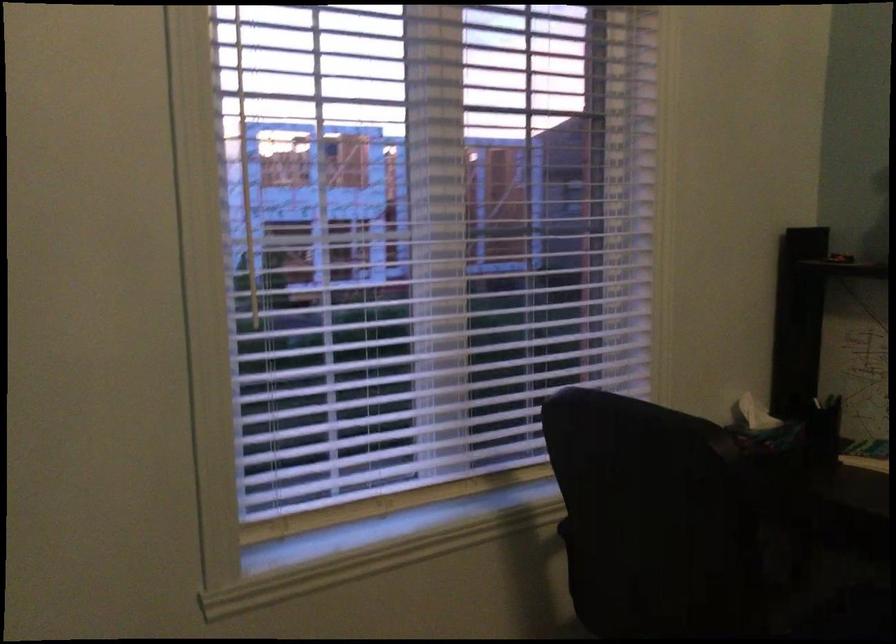
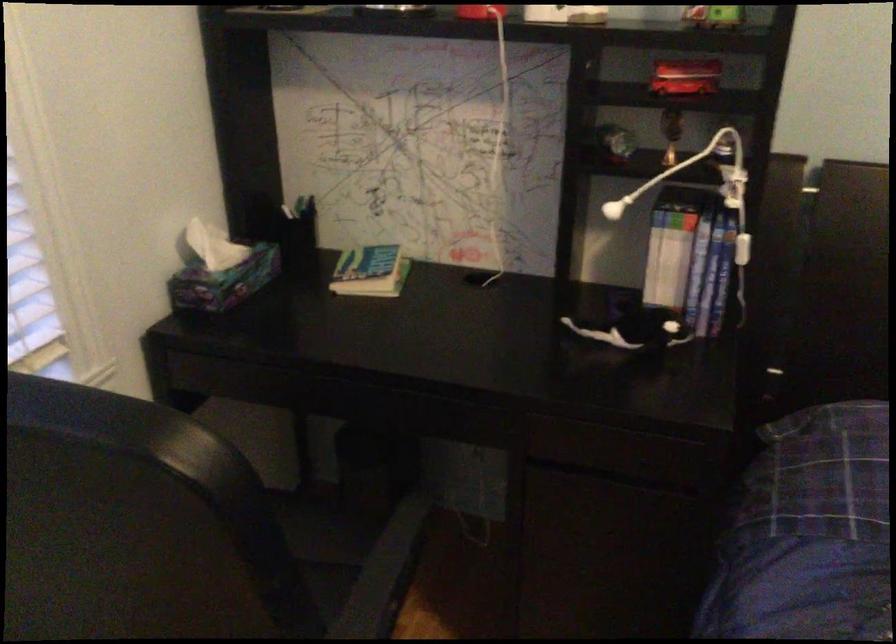
Based on the continuous images, in which direction is the camera rotating?

The camera rotated toward right-down.